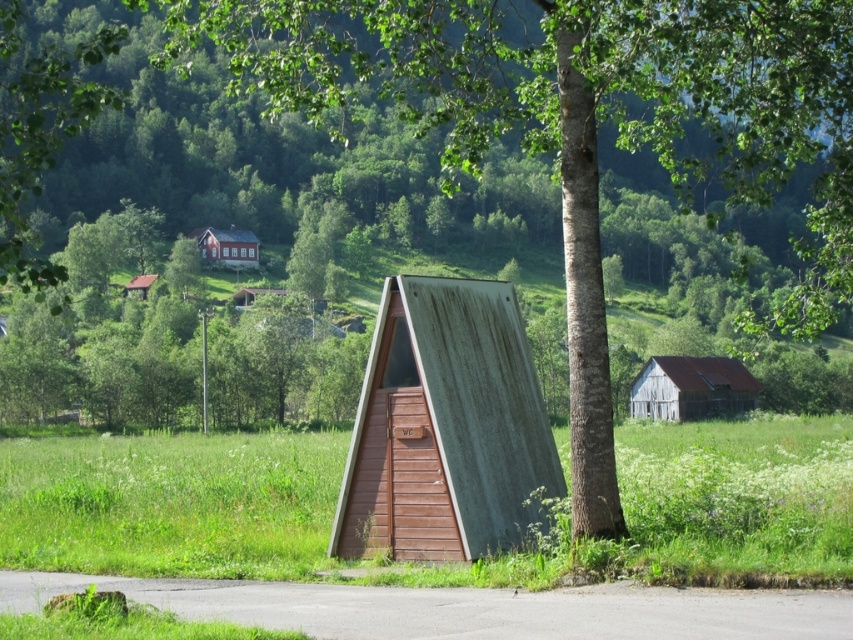
Question: Is rusty metal shed at center in front of matte red cabin at upper center?

Choices:
 (A) no
 (B) yes

Answer: (B)

Question: Considering the real-world distances, which object is closest to the rusty corrugated metal hut at center?

Choices:
 (A) matte red cabin at upper center
 (B) green rough bark tree at center
 (C) rusty metal shed at center
 (D) green grass at lower center

Answer: (B)

Question: Observing the image, what is the correct spatial positioning of green rough bark tree at center in reference to matte red cabin at upper center?

Choices:
 (A) left
 (B) right

Answer: (B)

Question: Which object is closer to the camera taking this photo?

Choices:
 (A) rusty metal shed at center
 (B) rusty corrugated metal hut at center

Answer: (A)

Question: Can you confirm if green rough bark tree at center is wider than rusty metal shed at center?

Choices:
 (A) no
 (B) yes

Answer: (B)

Question: Which of the following is the closest to the observer?

Choices:
 (A) (534, 412)
 (B) (207, 250)
 (C) (328, 468)

Answer: (A)